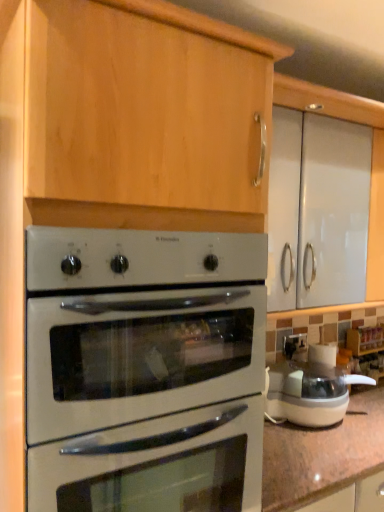
Describe the element at coordinates (135, 342) in the screenshot. Image resolution: width=384 pixels, height=512 pixels. I see `white glossy oven at center` at that location.

At what (x,y) coordinates should I click in order to perform the action: click on white glossy oven at center. Please return your answer as a coordinate pair (x, y). Image resolution: width=384 pixels, height=512 pixels. Looking at the image, I should click on (135, 342).

This screenshot has width=384, height=512. What do you see at coordinates (310, 389) in the screenshot?
I see `white plastic food processor at right` at bounding box center [310, 389].

I want to click on white plastic food processor at right, so click(310, 389).

In order to face white plastic food processor at right, should I rotate leftwards or rightwards?

A 15.427 degree turn to the right will do.

Identify the location of white glossy oven at center. The height and width of the screenshot is (512, 384). 135,342.

Which is more to the left, white plastic food processor at right or white glossy oven at center?

white glossy oven at center.

Is white plastic food processor at right closer to the viewer compared to white glossy oven at center?

No, the depth of white plastic food processor at right is greater than that of white glossy oven at center.

Which is further, (299,409) or (58,493)?

The point (299,409) is farther.

From the image's perspective, between white plastic food processor at right and white glossy oven at center, which one is located above?

white glossy oven at center.

From a real-world perspective, who is located lower, white plastic food processor at right or white glossy oven at center?

In real-world perspective, white plastic food processor at right is lower.

Based on the photo, which of these two, white plastic food processor at right or white glossy oven at center, is thinner?

Thinner between the two is white plastic food processor at right.

Who is shorter, white plastic food processor at right or white glossy oven at center?

Standing shorter between the two is white plastic food processor at right.

Can you confirm if white plastic food processor at right is smaller than white glossy oven at center?

Indeed, white plastic food processor at right has a smaller size compared to white glossy oven at center.

Is white plastic food processor at right not inside white glossy oven at center?

Yes, white plastic food processor at right is not within white glossy oven at center.

Are white plastic food processor at right and white glossy oven at center beside each other?

No, white plastic food processor at right is not with white glossy oven at center.

Is white plastic food processor at right positioned with its back to white glossy oven at center?

That's not correct — white plastic food processor at right is not looking away from white glossy oven at center.

Measure the distance between white plastic food processor at right and white glossy oven at center.

white plastic food processor at right is 30.11 inches from white glossy oven at center.

Where is `appliance on the right of white glossy oven at center`? The height and width of the screenshot is (512, 384). appliance on the right of white glossy oven at center is located at coordinates (310, 389).

Considering the positions of objects white glossy oven at center and white plastic food processor at right in the image provided, who is more to the left, white glossy oven at center or white plastic food processor at right?

Positioned to the left is white glossy oven at center.

Is white glossy oven at center positioned in front of white plastic food processor at right?

Yes, it is in front of white plastic food processor at right.

Does point (164, 319) come closer to viewer compared to point (294, 384)?

That is True.

From the image's perspective, is white glossy oven at center above or below white plastic food processor at right?

From the image's perspective, white glossy oven at center appears above white plastic food processor at right.

From a real-world perspective, which object rests below the other?

In real-world perspective, white plastic food processor at right is lower.

Can you confirm if white glossy oven at center is thinner than white plastic food processor at right?

In fact, white glossy oven at center might be wider than white plastic food processor at right.

In terms of height, does white glossy oven at center look taller or shorter compared to white plastic food processor at right?

Considering their sizes, white glossy oven at center has more height than white plastic food processor at right.

Considering the relative sizes of white glossy oven at center and white plastic food processor at right in the image provided, is white glossy oven at center smaller than white plastic food processor at right?

No.

Is white glossy oven at center situated inside white plastic food processor at right or outside?

white glossy oven at center is outside white plastic food processor at right.

Is white glossy oven at center next to white plastic food processor at right?

No, white glossy oven at center is not in contact with white plastic food processor at right.

Is white glossy oven at center oriented towards white plastic food processor at right?

No.

Measure the distance between white glossy oven at center and white plastic food processor at right.

white glossy oven at center is 30.11 inches away from white plastic food processor at right.

In order to click on oven on the left of white plastic food processor at right in this screenshot , I will do [135, 342].

Image resolution: width=384 pixels, height=512 pixels. In order to click on oven that appears on the left of white plastic food processor at right in this screenshot , I will do `click(135, 342)`.

Identify the location of oven that is in front of the white plastic food processor at right. Image resolution: width=384 pixels, height=512 pixels. (135, 342).